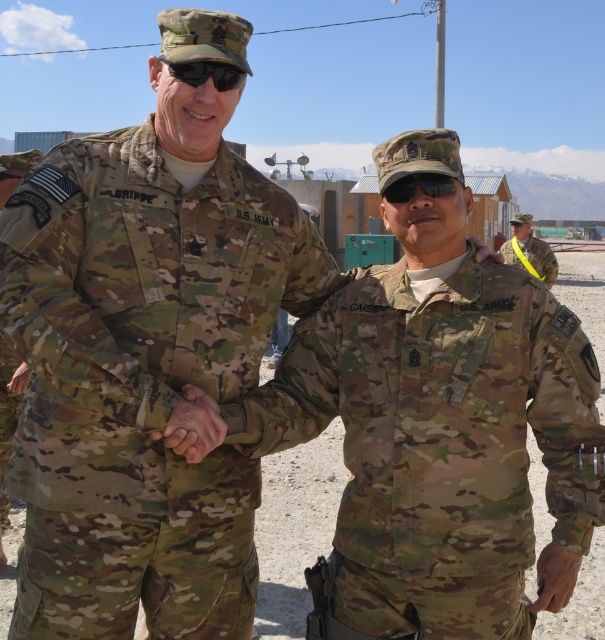
Can you confirm if camouflage fabric uniform at center is thinner than black matte sunglasses at upper center?

No, camouflage fabric uniform at center is not thinner than black matte sunglasses at upper center.

Does point (598, 636) come closer to viewer compared to point (192, 81)?

No, it is behind (192, 81).

Image resolution: width=605 pixels, height=640 pixels. Find the location of `camouflage fabric uniform at center`. camouflage fabric uniform at center is located at coordinates (295, 529).

Which is below, black matte sunglasses at upper center or black matte sunglasses at center?

black matte sunglasses at center

Which of these two, black matte sunglasses at upper center or black matte sunglasses at center, stands taller?

Standing taller between the two is black matte sunglasses at upper center.

Describe the element at coordinates (206, 74) in the screenshot. This screenshot has height=640, width=605. I see `black matte sunglasses at upper center` at that location.

Image resolution: width=605 pixels, height=640 pixels. What are the coordinates of `black matte sunglasses at upper center` in the screenshot? It's located at (206, 74).

Does camouflage uniform at right appear over black matte sunglasses at upper center?

No.

This screenshot has height=640, width=605. What do you see at coordinates (528, 250) in the screenshot?
I see `camouflage uniform at right` at bounding box center [528, 250].

The height and width of the screenshot is (640, 605). I want to click on camouflage uniform at right, so click(528, 250).